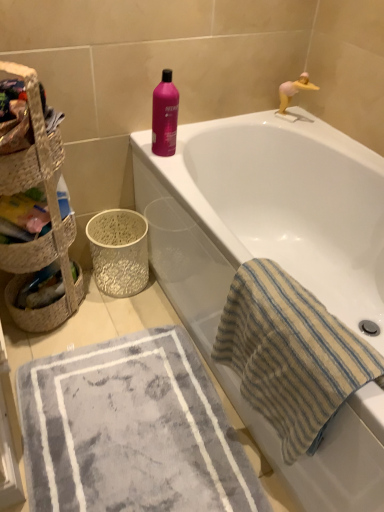
At what (x,y) coordinates should I click in order to perform the action: click on vacant area that is in front of pink plastic toy at upper right. Please return your answer as a coordinate pair (x, y). This screenshot has width=384, height=512. Looking at the image, I should click on (313, 132).